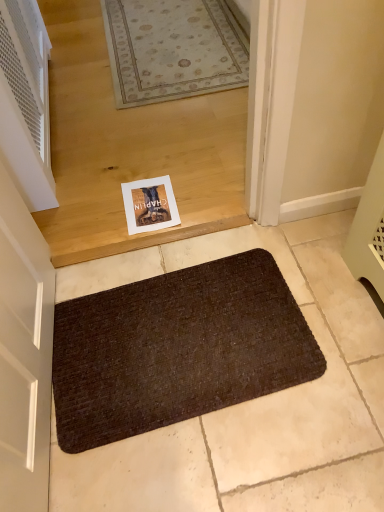
In order to click on free spot in front of brown textured bath mat at lower center in this screenshot , I will do `click(206, 462)`.